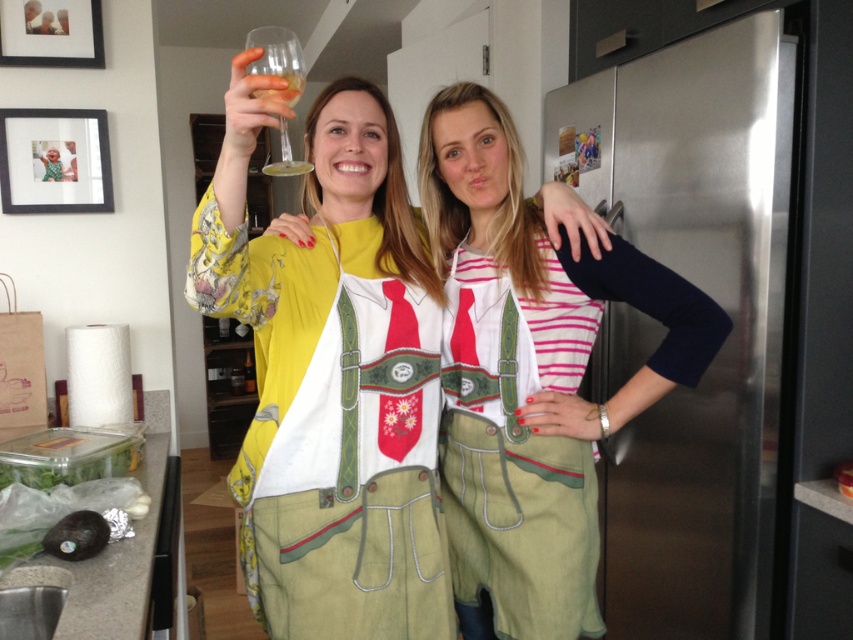
You are a chef trying to choose between two aprons displayed in the center of the kitchen. The green fabric apron at center and the green cotton apron at center. Which one is taller?

The green fabric apron at center is much taller than the green cotton apron at center.

In the kitchen scene, there are two objects of interest. The first is the green fabric apron at center, and the second is the clear glass wine glass at upper left. From an observer standing in front of the scene, which object is positioned more to the right?

The green fabric apron at center is positioned to the right of the clear glass wine glass at upper left, so the green fabric apron at center is more to the right.

You are a chef entering a kitchen and need to reach both the green fabric apron at center and the green cotton apron at center. Which apron is closer to you?

The green fabric apron at center is closer to you because the green cotton apron at center is behind it.